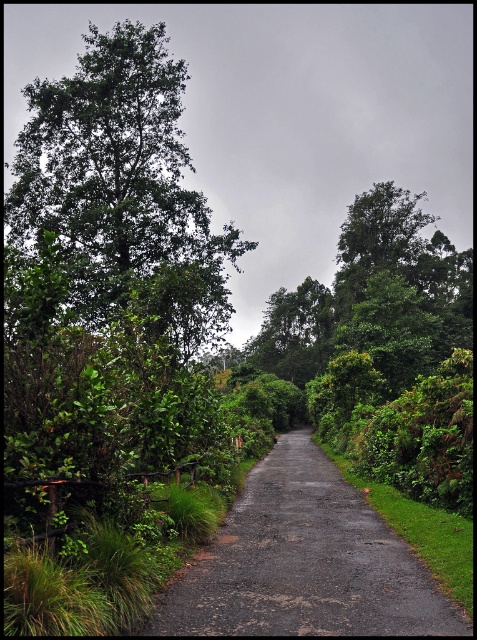
You are standing at the center of the road and notice the green leafy tree at left. Based on its position, can you determine if it is closer to the front or the back of the image?

The green leafy tree at left is located at point coordinates that are closer to the front of the image since the y coordinate is 0.258, which is lower than 0.5, indicating it is positioned in the upper half of the image.

You are driving a car and see the green leafy tree at left and the dark gray asphalt road at center. Which object is closer to you?

The green leafy tree at left is closer to you because the dark gray asphalt road at center is behind it.

You are a delivery driver navigating a narrow road surrounded by greenery. You need to pass under the green leafy tree at left without hitting it. Based on the scene, can you safely pass under it while staying on the dark gray asphalt road at center?

The green leafy tree at left is located above the dark gray asphalt road at center, so yes, you can safely pass under it while staying on the dark gray asphalt road at center as the tree is positioned overhead.